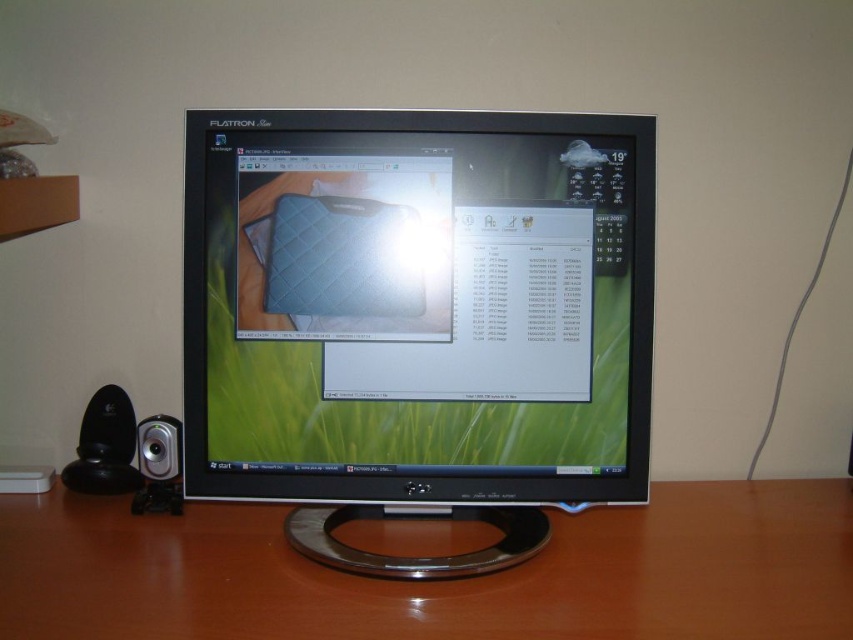
Is black plastic speaker at lower left bigger than silver metallic speaker at lower left?

Yes.

Which is in front, point (120, 449) or point (175, 451)?

Point (175, 451)

What are the coordinates of `black plastic speaker at lower left` in the screenshot? It's located at coord(103,445).

Does brown wood computer desk at center have a greater width compared to silver metallic speaker at lower left?

Correct, the width of brown wood computer desk at center exceeds that of silver metallic speaker at lower left.

Which of these two, brown wood computer desk at center or silver metallic speaker at lower left, stands taller?

Standing taller between the two is silver metallic speaker at lower left.

Which is behind, point (602, 634) or point (140, 448)?

Point (140, 448)

Locate an element on the screen. This screenshot has width=853, height=640. brown wood computer desk at center is located at coordinates (438, 580).

How far apart are brown wood computer desk at center and black plastic speaker at lower left?

14.33 inches

Is brown wood computer desk at center positioned before black plastic speaker at lower left?

Yes, it is in front of black plastic speaker at lower left.

Identify the location of brown wood computer desk at center. This screenshot has height=640, width=853. (438, 580).